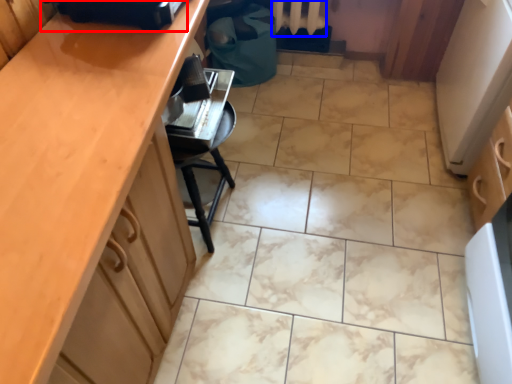
Question: Which object appears farthest to the camera in this image, appliance (highlighted by a red box) or radiator (highlighted by a blue box)?

Choices:
 (A) appliance
 (B) radiator

Answer: (B)